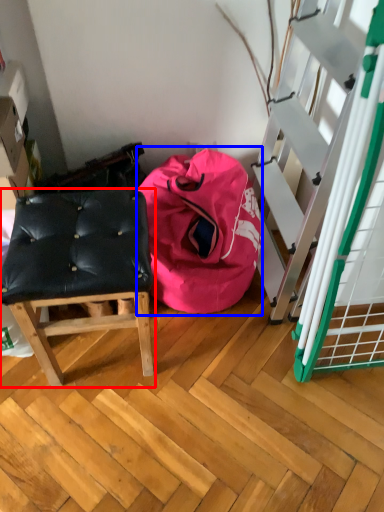
Question: Which of the following is the closest to the observer, furniture (highlighted by a red box) or bean bag chair (highlighted by a blue box)?

Choices:
 (A) furniture
 (B) bean bag chair

Answer: (A)